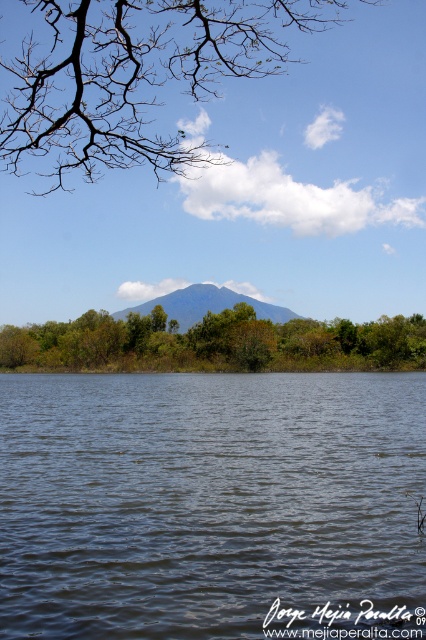
Question: Which object appears closest to the camera in this image?

Choices:
 (A) bare branches at upper center
 (B) green leafy trees at center
 (C) transparent water at center

Answer: (C)

Question: Which object is the closest to the green leafy trees at center?

Choices:
 (A) transparent water at center
 (B) gray/volcanic rock mountain at center

Answer: (B)

Question: Is transparent water at center below bare branches at upper center?

Choices:
 (A) no
 (B) yes

Answer: (B)

Question: Does transparent water at center have a lesser width compared to gray/volcanic rock mountain at center?

Choices:
 (A) no
 (B) yes

Answer: (B)

Question: Which of the following is the closest to the observer?

Choices:
 (A) (13, 134)
 (B) (178, 298)
 (C) (155, 332)

Answer: (A)

Question: Considering the relative positions of transparent water at center and bare branches at upper center in the image provided, where is transparent water at center located with respect to bare branches at upper center?

Choices:
 (A) left
 (B) right

Answer: (B)